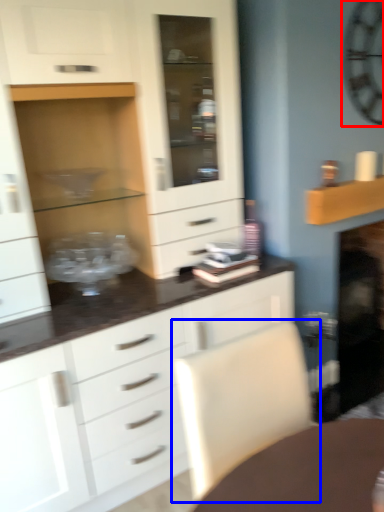
Question: Among these objects, which one is nearest to the camera, clock (highlighted by a red box) or swivel chair (highlighted by a blue box)?

Choices:
 (A) clock
 (B) swivel chair

Answer: (B)